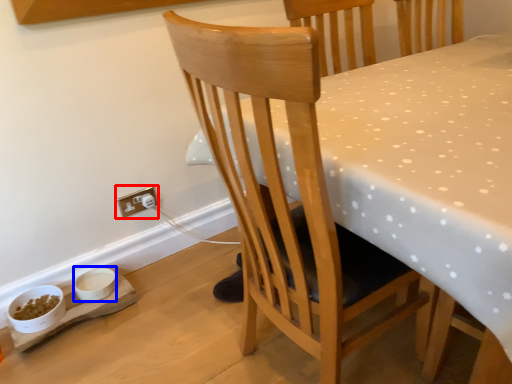
Question: Among these objects, which one is nearest to the camera, electric outlet (highlighted by a red box) or bowl (highlighted by a blue box)?

Choices:
 (A) electric outlet
 (B) bowl

Answer: (B)